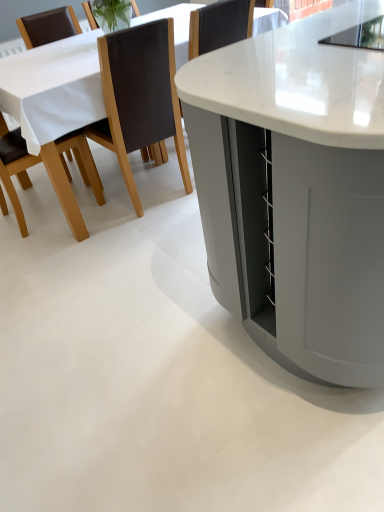
Question: Can you confirm if brown leather chair at upper left, the 2th chair positioned from the left, is shorter than brown leather chair at left, the 2th chair in the right-to-left sequence?

Choices:
 (A) no
 (B) yes

Answer: (A)

Question: From a real-world perspective, is brown leather chair at upper left, the 2th chair positioned from the left, beneath brown leather chair at left, the 1th chair viewed from the left?

Choices:
 (A) yes
 (B) no

Answer: (B)

Question: Is brown leather chair at upper left, the 2th chair positioned from the left, wider than brown leather chair at left, the 1th chair viewed from the left?

Choices:
 (A) no
 (B) yes

Answer: (A)

Question: From a real-world perspective, is brown leather chair at upper left, which is the 1th chair from right to left, on brown leather chair at left, the 1th chair viewed from the left?

Choices:
 (A) no
 (B) yes

Answer: (B)

Question: Can brown leather chair at left, the 2th chair in the right-to-left sequence, be found inside brown leather chair at upper left, which is the 1th chair from right to left?

Choices:
 (A) yes
 (B) no

Answer: (B)

Question: Is brown leather chair at upper left, which is the 1th chair from right to left, positioned before brown leather chair at left, the 2th chair in the right-to-left sequence?

Choices:
 (A) no
 (B) yes

Answer: (B)

Question: Does white marble table at center, the 2th table from the front, appear on the right side of brown leather chair at left, the 1th chair viewed from the left?

Choices:
 (A) yes
 (B) no

Answer: (A)

Question: Does white marble table at center, the 2th table from the front, have a lesser width compared to brown leather chair at left, the 2th chair in the right-to-left sequence?

Choices:
 (A) yes
 (B) no

Answer: (B)

Question: Considering the relative positions of white marble table at center, the 1th table viewed from the back, and brown leather chair at left, the 1th chair viewed from the left, in the image provided, is white marble table at center, the 1th table viewed from the back, to the left of brown leather chair at left, the 1th chair viewed from the left, from the viewer's perspective?

Choices:
 (A) no
 (B) yes

Answer: (A)

Question: Is white marble table at center, the 1th table viewed from the back, shorter than brown leather chair at left, the 2th chair in the right-to-left sequence?

Choices:
 (A) yes
 (B) no

Answer: (A)

Question: Is white marble table at center, the 1th table viewed from the back, touching brown leather chair at left, the 2th chair in the right-to-left sequence?

Choices:
 (A) yes
 (B) no

Answer: (B)

Question: Does white marble table at center, the 2th table from the front, lie in front of brown leather chair at left, the 2th chair in the right-to-left sequence?

Choices:
 (A) yes
 (B) no

Answer: (A)

Question: From a real-world perspective, is white marble table at center, positioned as the first table in front-to-back order, beneath brown leather chair at upper left, which is the 1th chair from right to left?

Choices:
 (A) no
 (B) yes

Answer: (A)